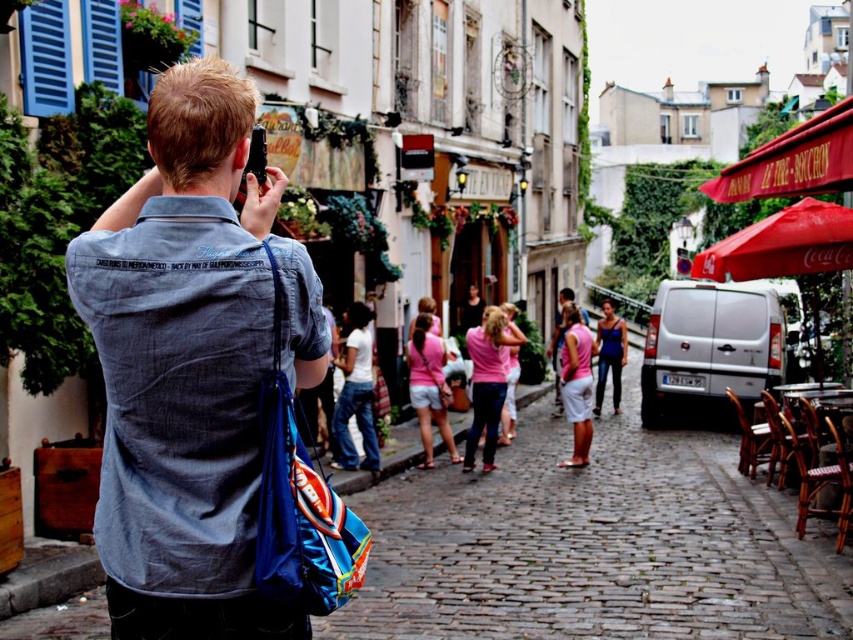
Can you confirm if denim jacket at upper left is shorter than pink fabric dress at center?

Correct, denim jacket at upper left is not as tall as pink fabric dress at center.

Looking at this image, can you confirm if denim jacket at upper left is wider than pink fabric dress at center?

In fact, denim jacket at upper left might be narrower than pink fabric dress at center.

The image size is (853, 640). I want to click on denim jacket at upper left, so click(x=190, y=364).